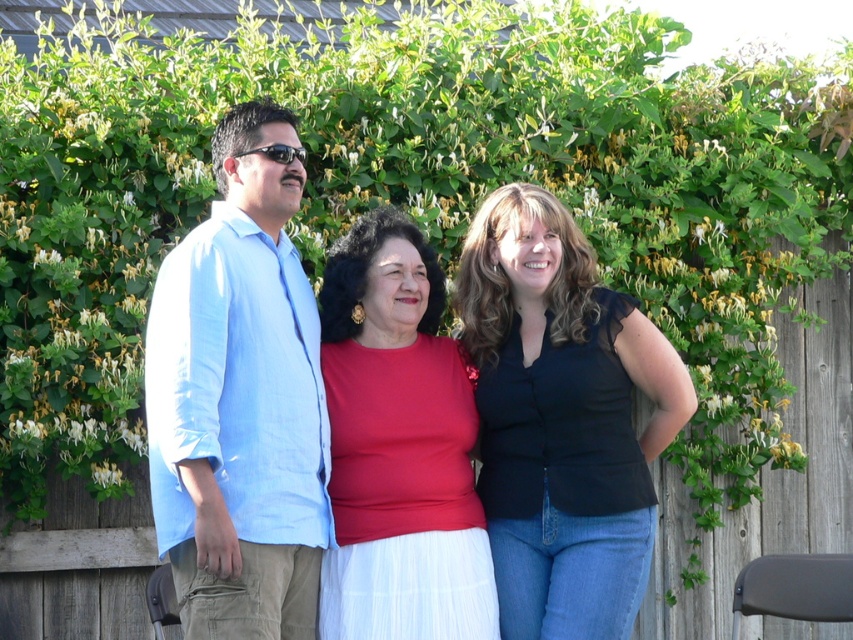
You are organizing a clothing sale and have two light blue shirts. The light blue shirt at center and the light blue cotton shirt at left are both available. If you want to display the wider shirt first, which one should you place in the front?

The light blue shirt at center is wider than the light blue cotton shirt at left, so you should place the light blue shirt at center in the front.

You are a photographer trying to capture a group photo of the light blue shirt at center and the matte red blouse at center. Since you want to ensure both are clearly visible, which clothing item should you focus on first to account for their size difference?

The light blue shirt at center is larger in size than the matte red blouse at center, so you should focus on the light blue shirt at center first as it occupies more space in the frame, ensuring it is sharply focused before adjusting for the smaller matte red blouse at center.

In the image, there are two people wearing a light blue shirt at center and a black matte top at center. Which one is positioned to the left?

The light blue shirt at center is to the left of the black matte top at center.